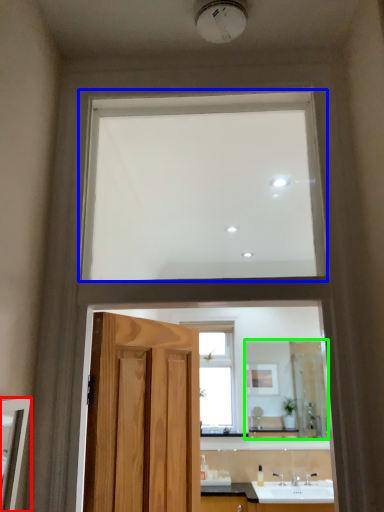
Question: Which object is the farthest from mirror (highlighted by a red box)? Choose among these: window (highlighted by a blue box) or mirror (highlighted by a green box).

Choices:
 (A) window
 (B) mirror

Answer: (B)